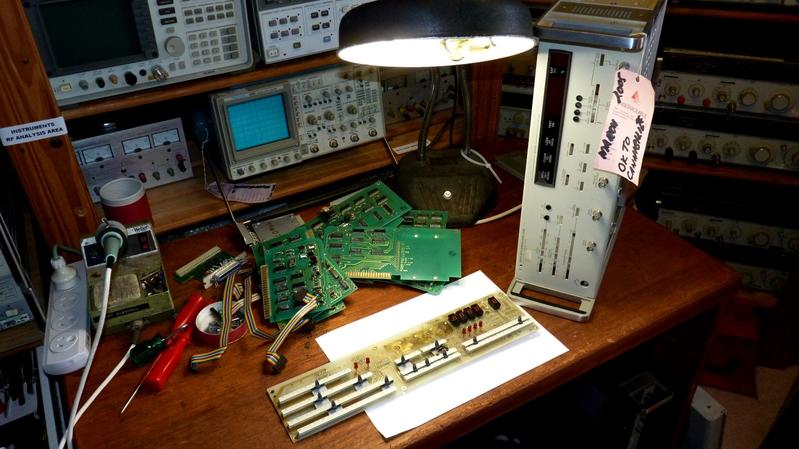
Where is `light`? light is located at coordinates 435,19.